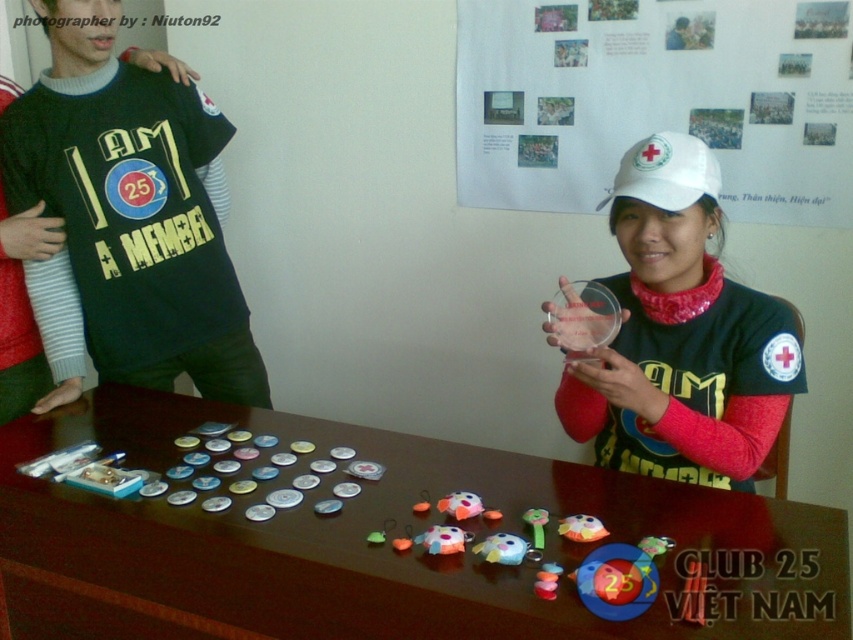
You are a GUI agent. You are given a task and a screenshot of the screen. Output one action in this format:
    pyautogui.click(x=<x>, y=<y>)
    Task: Click on the white paper at upper center
    The image size is (853, 640).
    Given the screenshot: What is the action you would take?
    pyautogui.click(x=656, y=99)

Which is in front, point (688, 99) or point (645, 202)?

Point (645, 202) is in front.

You are a GUI agent. You are given a task and a screenshot of the screen. Output one action in this format:
    pyautogui.click(x=<x>, y=<y>)
    Task: Click on the white paper at upper center
    Image resolution: width=853 pixels, height=640 pixels.
    Given the screenshot: What is the action you would take?
    pyautogui.click(x=656, y=99)

From the picture: Does white paper at upper center have a greater width compared to white matte cap at upper right?

Yes, white paper at upper center is wider than white matte cap at upper right.

Does white paper at upper center appear on the left side of white matte cap at upper right?

No, white paper at upper center is not to the left of white matte cap at upper right.

Find the location of `white paper at upper center`. white paper at upper center is located at coordinates (656, 99).

Is wooden table at center above white matte baseball cap at upper center?

No, wooden table at center is not above white matte baseball cap at upper center.

Which is more to the left, wooden table at center or white matte baseball cap at upper center?

Positioned to the left is wooden table at center.

Describe the element at coordinates (381, 544) in the screenshot. The image size is (853, 640). I see `wooden table at center` at that location.

Locate an element on the screen. The width and height of the screenshot is (853, 640). wooden table at center is located at coordinates (381, 544).